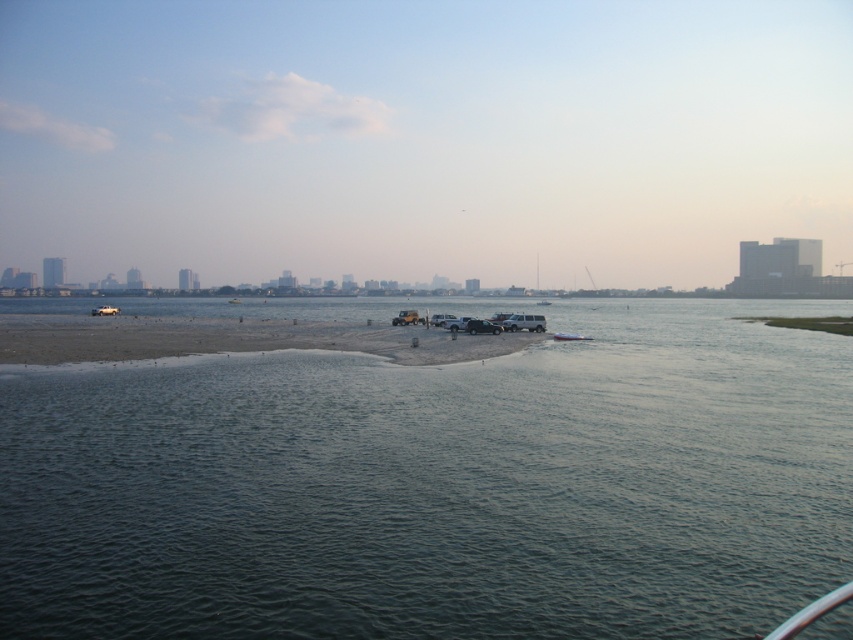
In the scene shown: You are planning to set up a picnic on the brown sandy beach at center. However, you also need to leave enough space for the metallic silver boat at center. Based on the scene, can you determine if there is sufficient space on the beach for both the picnic setup and the boat?

The brown sandy beach at center has a larger width than the metallic silver boat at center, so there is enough space to accommodate both the picnic setup and the boat on the beach.